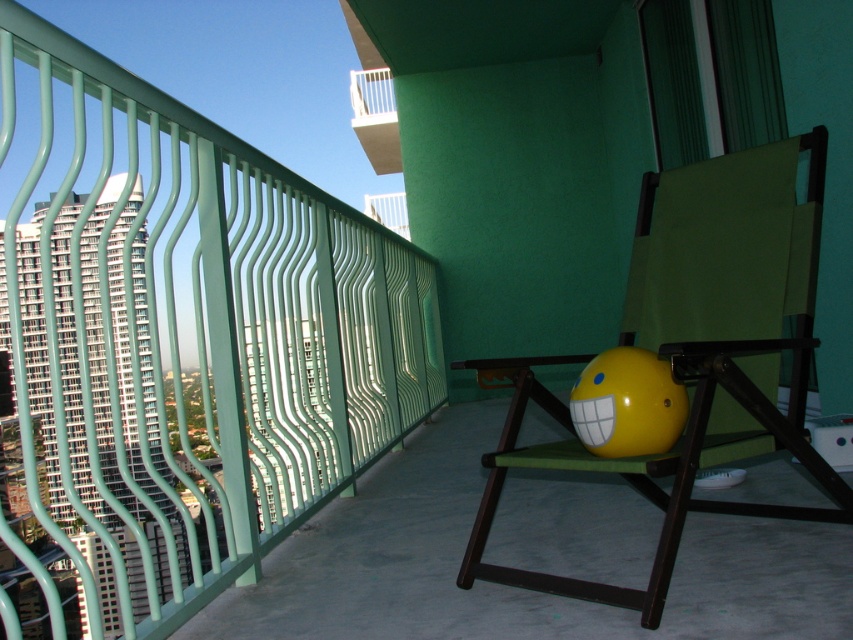
Consider the image. Does matte green folding chair at center have a greater width compared to yellow matte beach ball at center?

Yes.

This screenshot has width=853, height=640. What do you see at coordinates (694, 352) in the screenshot? I see `matte green folding chair at center` at bounding box center [694, 352].

The width and height of the screenshot is (853, 640). Identify the location of matte green folding chair at center. (694, 352).

Is matte green folding chair at center above white glossy balcony at upper center?

Incorrect, matte green folding chair at center is not positioned above white glossy balcony at upper center.

Does matte green folding chair at center have a lesser height compared to white glossy balcony at upper center?

Indeed, matte green folding chair at center has a lesser height compared to white glossy balcony at upper center.

Describe the element at coordinates (694, 352) in the screenshot. I see `matte green folding chair at center` at that location.

Locate an element on the screen. The width and height of the screenshot is (853, 640). matte green folding chair at center is located at coordinates (694, 352).

Is yellow matte beach ball at center shorter than white glossy balcony at upper center?

Correct, yellow matte beach ball at center is not as tall as white glossy balcony at upper center.

Is yellow matte beach ball at center taller than white glossy balcony at upper center?

Incorrect, yellow matte beach ball at center's height is not larger of white glossy balcony at upper center's.

You are a GUI agent. You are given a task and a screenshot of the screen. Output one action in this format:
    pyautogui.click(x=<x>, y=<y>)
    Task: Click on the yellow matte beach ball at center
    
    Given the screenshot: What is the action you would take?
    pyautogui.click(x=627, y=403)